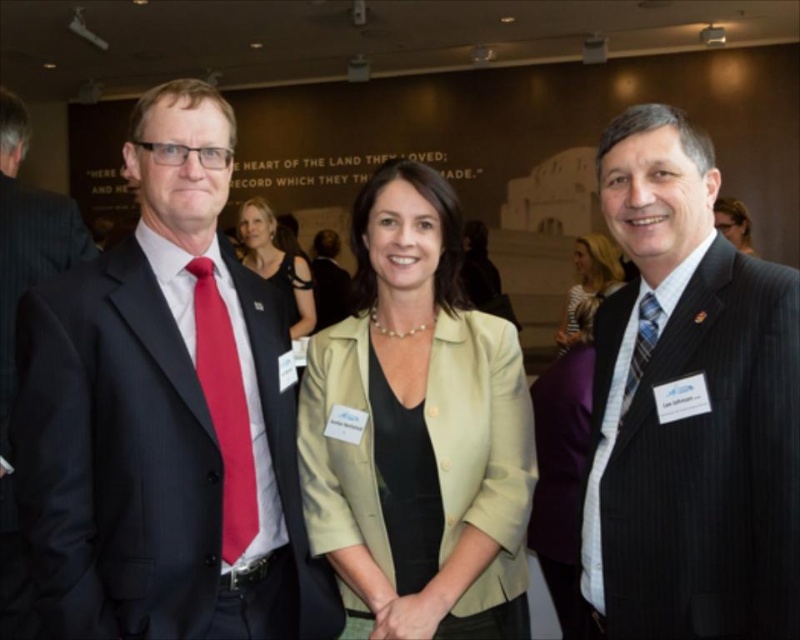
Which is above, black satin dress at center or matte black suit at center?

matte black suit at center is above.

Image resolution: width=800 pixels, height=640 pixels. What do you see at coordinates (276, 264) in the screenshot?
I see `black satin dress at center` at bounding box center [276, 264].

The image size is (800, 640). I want to click on black satin dress at center, so click(276, 264).

Does striped suit at right appear over matte purple blazer at center?

Yes.

Is striped suit at right below matte purple blazer at center?

No, striped suit at right is not below matte purple blazer at center.

Between point (668, 554) and point (580, 364), which one is positioned behind?

The point (580, 364) is more distant.

The width and height of the screenshot is (800, 640). Find the location of `striped suit at right`. striped suit at right is located at coordinates point(690,413).

Is matte purple blazer at center wider than matte black suit at center?

No, matte purple blazer at center is not wider than matte black suit at center.

Can you confirm if matte purple blazer at center is taller than matte black suit at center?

Correct, matte purple blazer at center is much taller as matte black suit at center.

Between point (552, 540) and point (333, 317), which one is positioned behind?

The point (333, 317) is behind.

Find the location of a particular element. matte purple blazer at center is located at coordinates (568, 429).